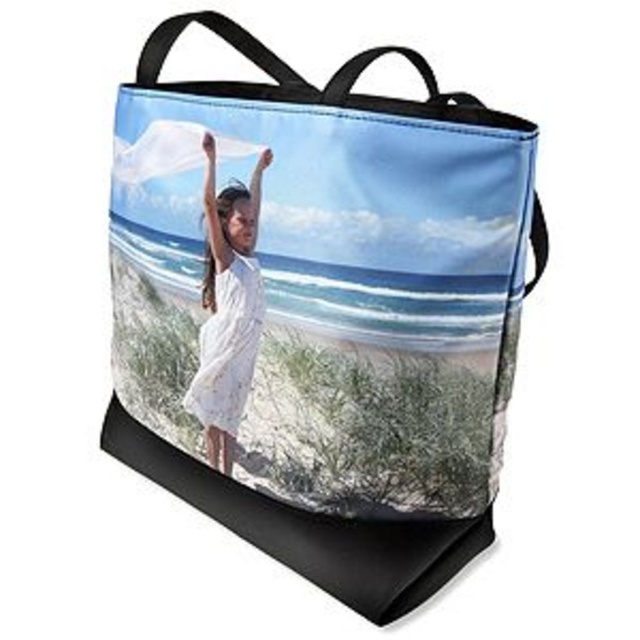
You are looking at the tote bag and notice two dresses in the print. Which dress is closer to you, the white cotton dress at center or the white lace dress at center?

The white cotton dress at center is closer to you because it is in front of the white lace dress at center in the print.

You are a delivery drone that is 0.5 meters wide. You are flying over a beach scene depicted on a tote bag. There is a point at (285, 65). Can you fit between them?

The two points are 1.34 meters apart, so yes, the drone can fit between them since the distance is wider than the drone.